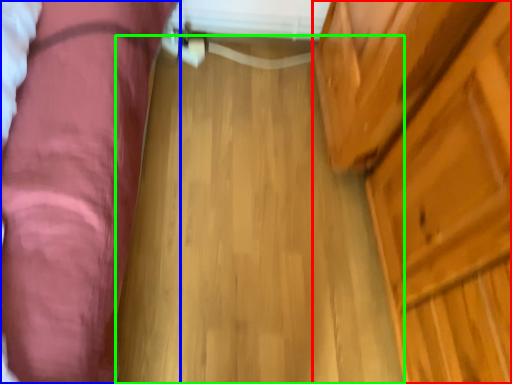
Question: Which object is the closest to the dresser (highlighted by a red box)? Choose among these: furniture (highlighted by a blue box) or plank (highlighted by a green box).

Choices:
 (A) furniture
 (B) plank

Answer: (B)